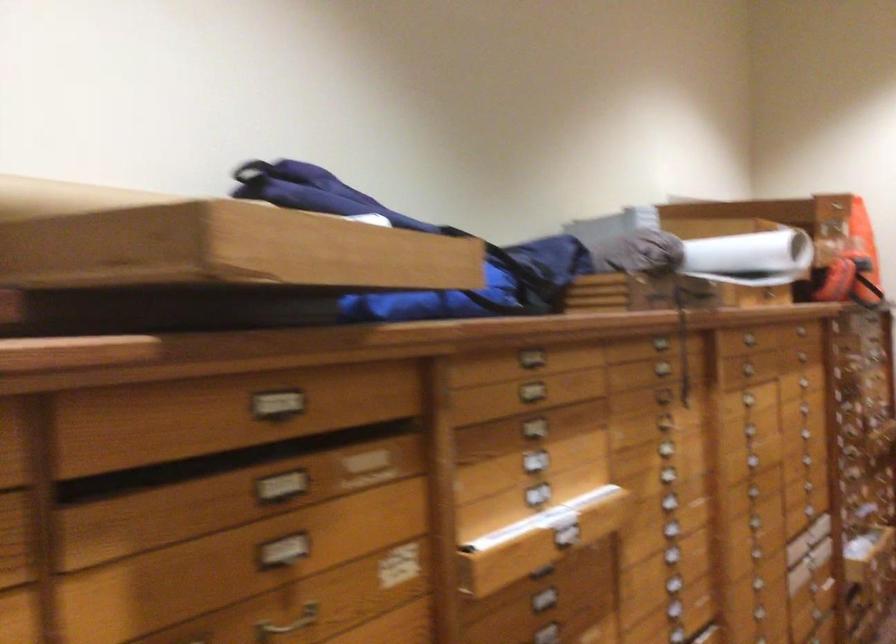
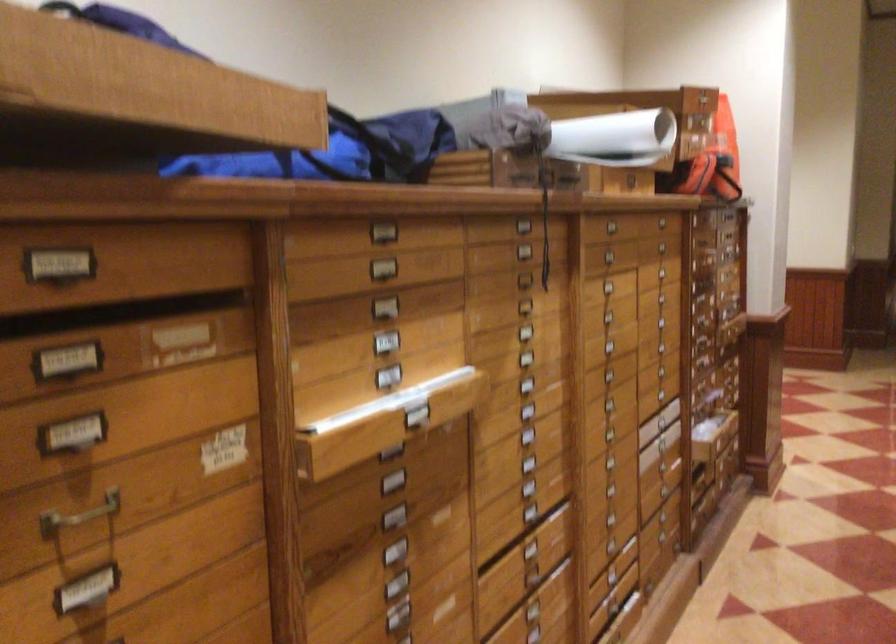
Locate, in the second image, the point that corresponds to [751,259] in the first image.

(615, 138)